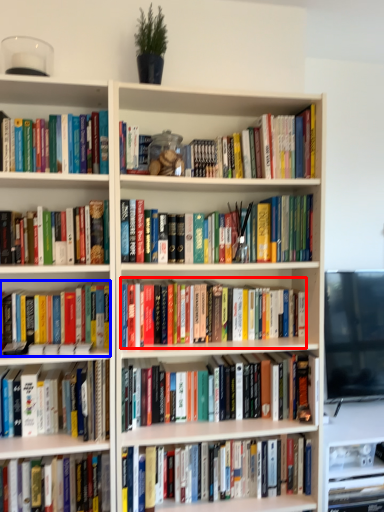
Question: Among these objects, which one is farthest to the camera, book (highlighted by a red box) or book (highlighted by a blue box)?

Choices:
 (A) book
 (B) book

Answer: (A)